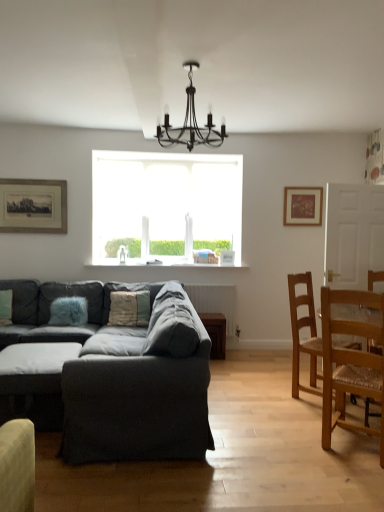
Question: Does dark gray fabric ottoman at lower left have a lesser width compared to light brown wooden chair at right, which appears as the second chair when viewed from the back?

Choices:
 (A) yes
 (B) no

Answer: (B)

Question: Is dark gray fabric ottoman at lower left smaller than light brown wooden chair at right, which appears as the second chair when viewed from the back?

Choices:
 (A) no
 (B) yes

Answer: (B)

Question: Would you say light brown wooden chair at right, which appears as the second chair when viewed from the back, is part of dark gray fabric ottoman at lower left's contents?

Choices:
 (A) yes
 (B) no

Answer: (B)

Question: From the image's perspective, is dark gray fabric ottoman at lower left on light brown wooden chair at right, which appears as the second chair when viewed from the back?

Choices:
 (A) yes
 (B) no

Answer: (B)

Question: Can we say dark gray fabric ottoman at lower left lies outside light brown wooden chair at right, the 1th chair viewed from the front?

Choices:
 (A) yes
 (B) no

Answer: (A)

Question: Considering the relative positions of dark gray fabric ottoman at lower left and light brown wooden chair at right, the 1th chair viewed from the front, in the image provided, is dark gray fabric ottoman at lower left to the left of light brown wooden chair at right, the 1th chair viewed from the front, from the viewer's perspective?

Choices:
 (A) no
 (B) yes

Answer: (B)

Question: From the image's perspective, is textured beige pillow at center, arranged as the 1th pillow when viewed from the right, over white frosted glass window at center?

Choices:
 (A) yes
 (B) no

Answer: (B)

Question: Is the depth of textured beige pillow at center, arranged as the 1th pillow when viewed from the right, less than that of white frosted glass window at center?

Choices:
 (A) yes
 (B) no

Answer: (A)

Question: Considering the relative sizes of textured beige pillow at center, the 2th pillow positioned from the left, and white frosted glass window at center in the image provided, is textured beige pillow at center, the 2th pillow positioned from the left, taller than white frosted glass window at center?

Choices:
 (A) no
 (B) yes

Answer: (A)

Question: Is textured beige pillow at center, the 2th pillow positioned from the left, next to white frosted glass window at center and touching it?

Choices:
 (A) no
 (B) yes

Answer: (A)

Question: Is the depth of textured beige pillow at center, arranged as the 1th pillow when viewed from the right, greater than that of white frosted glass window at center?

Choices:
 (A) no
 (B) yes

Answer: (A)

Question: Considering the relative sizes of textured beige pillow at center, the 2th pillow positioned from the left, and white frosted glass window at center in the image provided, is textured beige pillow at center, the 2th pillow positioned from the left, smaller than white frosted glass window at center?

Choices:
 (A) no
 (B) yes

Answer: (B)

Question: Can you confirm if dark gray fabric ottoman at lower left is wider than textured beige pillow at center, the 2th pillow positioned from the left?

Choices:
 (A) yes
 (B) no

Answer: (A)